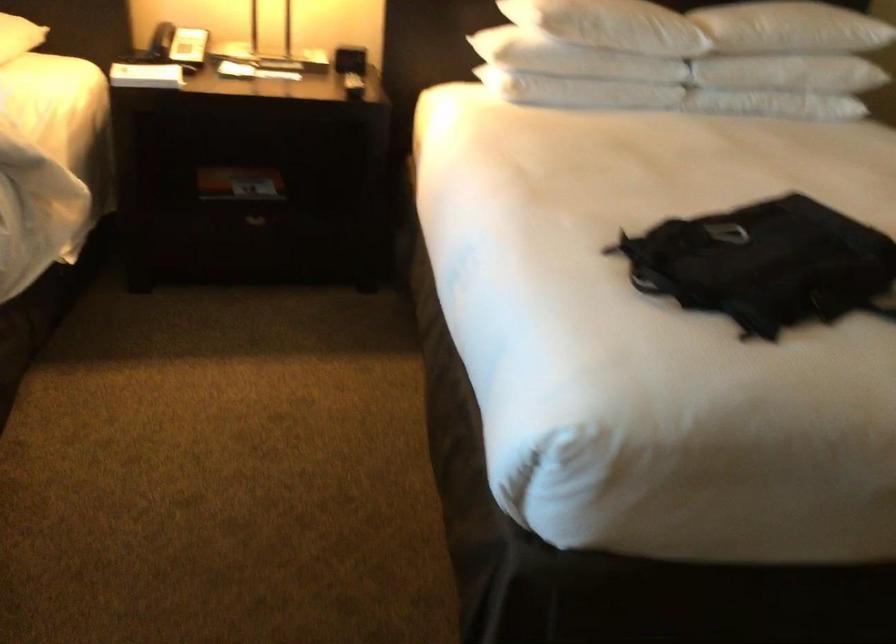
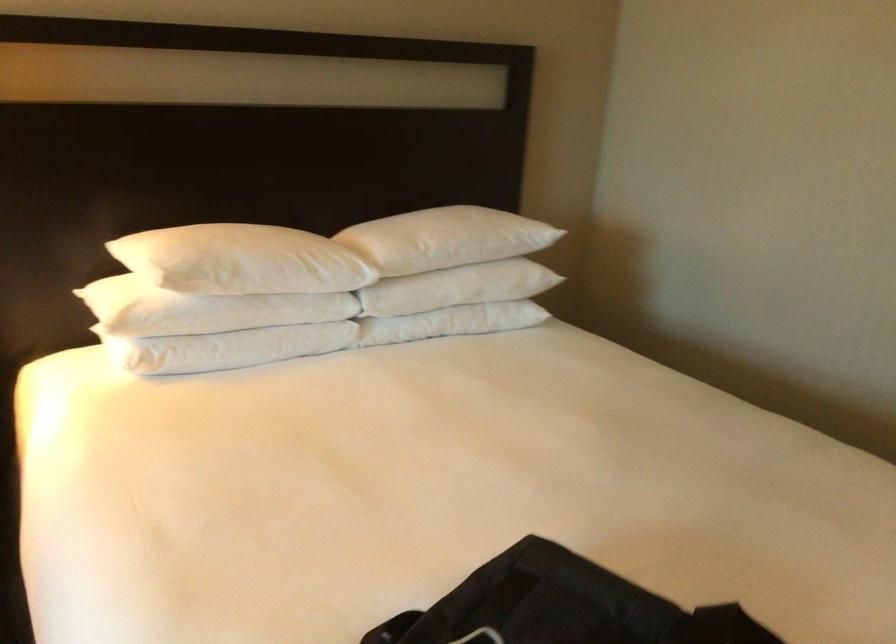
Find the pixel in the second image that matches (573,84) in the first image.

(226, 348)